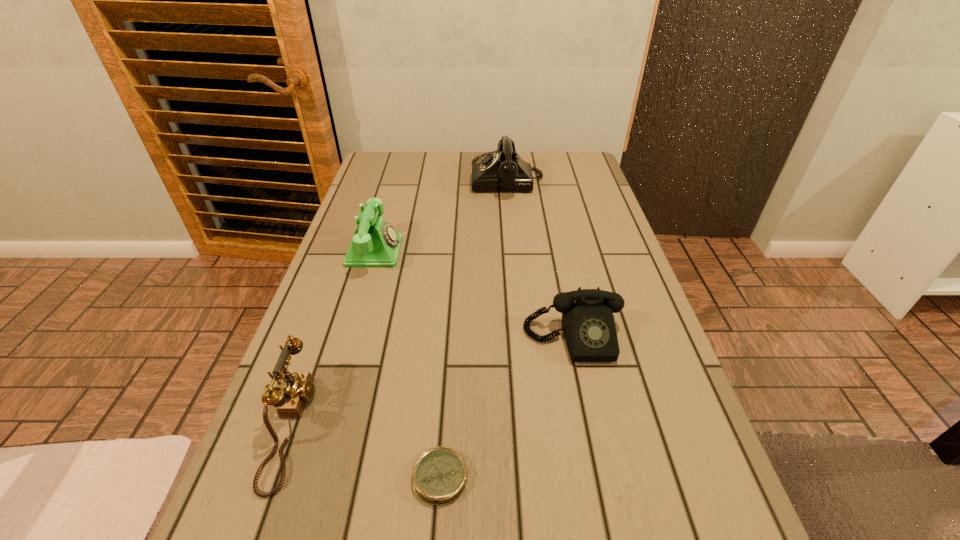
Identify the location of free space located 0.130m on the front-facing side of the nearest telephone. This screenshot has height=540, width=960. (380, 426).

The height and width of the screenshot is (540, 960). I want to click on vacant position located on the dial of the third nearest object, so [x=608, y=499].

The image size is (960, 540). In order to click on vacant area located 0.250m on the back of the shortest object in this screenshot , I will do `click(450, 338)`.

Find the location of `object that is at the far edge`. object that is at the far edge is located at coordinates (502, 170).

Image resolution: width=960 pixels, height=540 pixels. What are the coordinates of `object present at the right edge` in the screenshot? It's located at (588, 324).

Where is `vacant position at the far edge of the desktop`? The image size is (960, 540). vacant position at the far edge of the desktop is located at coordinates (445, 155).

In order to click on blank space at the left edge of the desktop in this screenshot , I will do `click(301, 352)`.

What are the coordinates of `free spot at the right edge of the desktop` in the screenshot? It's located at (597, 212).

In the image, there is a desktop. Where is `free space at the far left corner`? The image size is (960, 540). free space at the far left corner is located at coordinates (412, 152).

Where is `free spot between the compass and the fourth nearest object`? The width and height of the screenshot is (960, 540). free spot between the compass and the fourth nearest object is located at coordinates point(408,364).